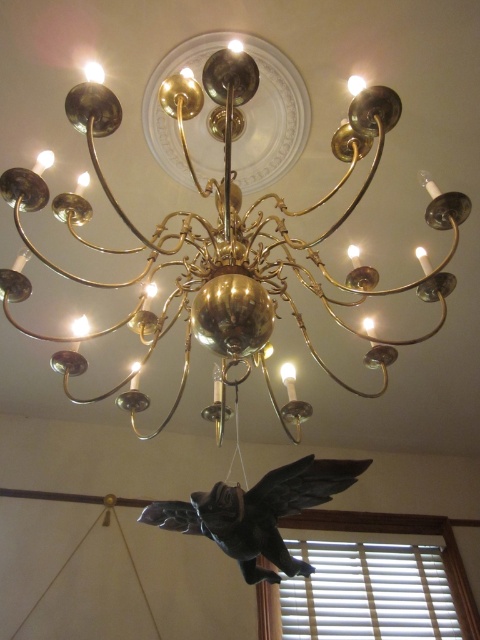
You are an interior designer planning to hang a new painting. The painting is 1.2 meters wide and needs to be centered exactly where the gold polished chandelier at center is currently located. Can you hang the painting in this spot without moving the chandelier?

The gold polished chandelier at center is located at point (229, 234). Since the painting is 1.2 meters wide and needs to be centered at the same point, you can hang the painting in this spot as long as there is enough space around the chandelier to accommodate the painting without obstruction. However, the chandelier itself is at the specified coordinates, so the painting can be positioned around it if the area allows.

You are standing in a room with a gold polished chandelier at center. A point is marked at coordinates (x=229, y=234). Is the gold polished chandelier at center located at this point?

The gold polished chandelier at center is located at point (x=229, y=234), so yes, the chandelier is at that point.

You are standing in a room with the chandelier and the angelic figure. You want to take a photo of the angelic figure without the chandelier in the background. Where should you position yourself relative to the point at coordinates point (186, 273)?

The point at coordinates point (186, 273) is 1.55 meters from the viewer. To avoid the chandelier in the background, position yourself closer than 1.55 meters to this point so the angelic figure is in focus and the chandelier is out of frame.